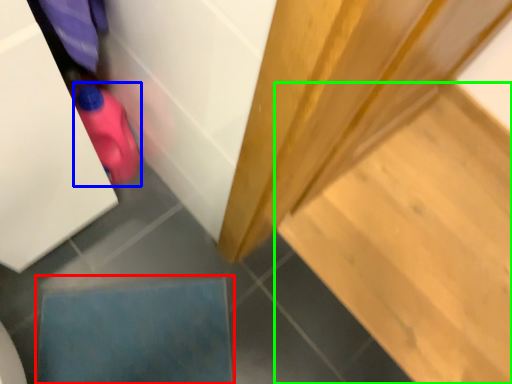
Question: Estimate the real-world distances between objects in this image. Which object is farther from square (highlighted by a red box), stuff (highlighted by a blue box) or stair (highlighted by a green box)?

Choices:
 (A) stuff
 (B) stair

Answer: (B)